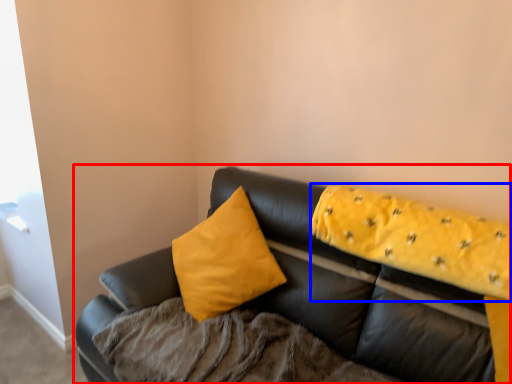
Question: Which point is closer to the camera, studio couch (highlighted by a red box) or blanket (highlighted by a blue box)?

Choices:
 (A) studio couch
 (B) blanket

Answer: (A)